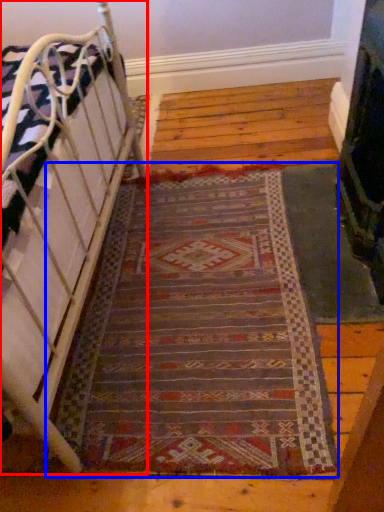
Question: Which of the following is the farthest to the observer, furniture (highlighted by a red box) or mat (highlighted by a blue box)?

Choices:
 (A) furniture
 (B) mat

Answer: (B)